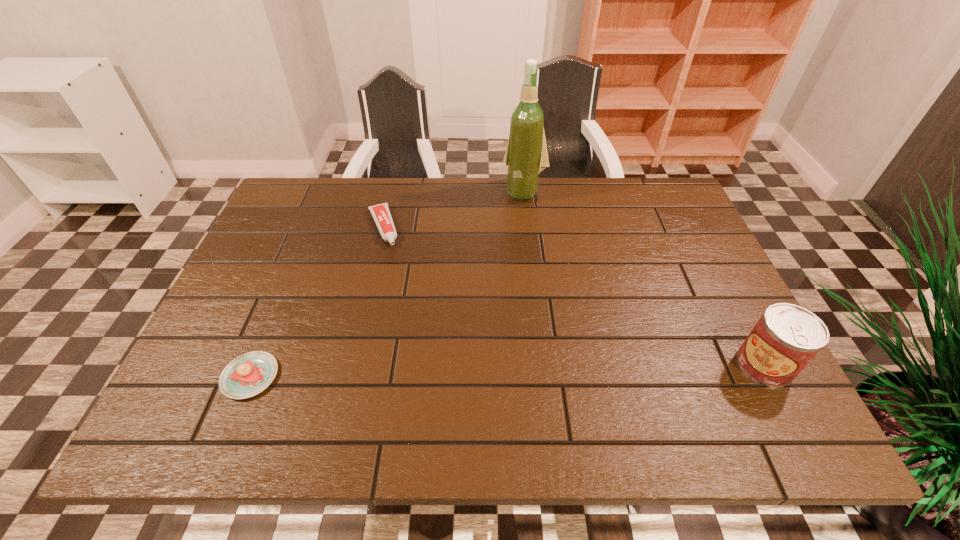
The image size is (960, 540). I want to click on object located at the right edge, so click(787, 337).

Where is `object positioned at the near left corner`? Image resolution: width=960 pixels, height=540 pixels. object positioned at the near left corner is located at coordinates (249, 374).

This screenshot has width=960, height=540. I want to click on object that is positioned at the near right corner, so click(787, 337).

Identify the location of vacant region at the far edge of the desktop. (592, 180).

Find the location of a particular element. The height and width of the screenshot is (540, 960). vacant space at the left edge is located at coordinates (261, 286).

This screenshot has height=540, width=960. In the image, there is a desktop. In order to click on free space at the right edge in this screenshot , I will do `click(663, 228)`.

Identify the location of vacant space at the far left corner of the desktop. Image resolution: width=960 pixels, height=540 pixels. (325, 202).

At what (x,y) coordinates should I click in order to perform the action: click on blank space at the far right corner of the desktop. Please return your answer as a coordinate pair (x, y). Looking at the image, I should click on (680, 226).

I want to click on vacant area between the second farthest object and the third shortest object, so click(574, 296).

The image size is (960, 540). In order to click on free area in between the leftmost object and the toothpaste in this screenshot , I will do `click(317, 302)`.